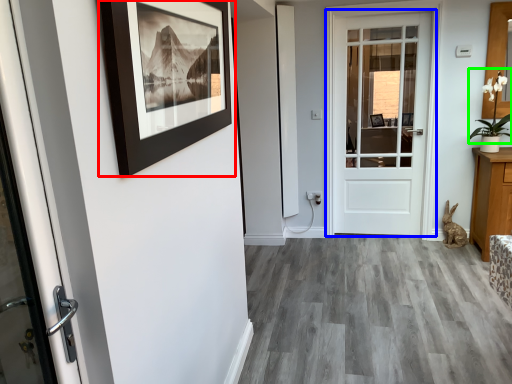
Question: Which object is positioned farthest from picture frame (highlighted by a red box)? Select from door (highlighted by a blue box) and plant (highlighted by a green box).

Choices:
 (A) door
 (B) plant

Answer: (B)